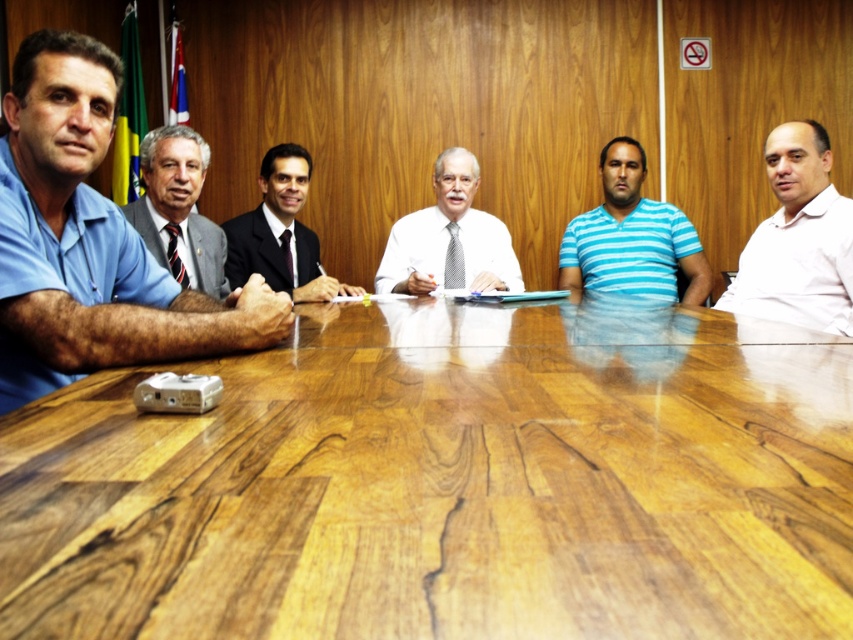
You are a service robot with a 1.5 meter long tray. You need to deliver a document from the white matte shirt at right to the dark suit at center. Can you place the tray between them without moving either person?

The distance between the white matte shirt at right and dark suit at center is 1.85 meters. Since the tray is 1.5 meters long, it can be placed between them as the distance is greater than the tray length.

You are standing at the entrance of the conference room and want to greet the person wearing the blue fabric shirt at left. In which direction should you walk to reach them?

The blue fabric shirt at left is located at point (90, 241), so you should walk towards the left side of the conference table to reach them.